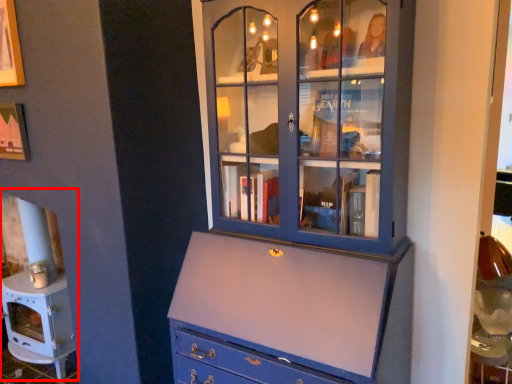
Question: From the image, what is the correct spatial relationship of fireplace (annotated by the red box) in relation to cupboard?

Choices:
 (A) right
 (B) left

Answer: (B)